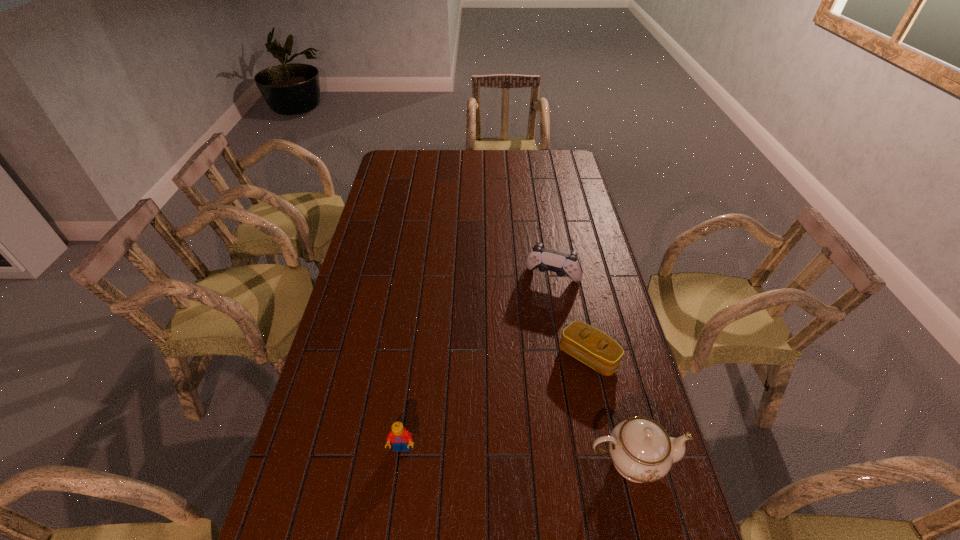
This screenshot has height=540, width=960. In order to click on Lego in this screenshot , I will do `click(400, 438)`.

Find the location of `the second shortest object`. the second shortest object is located at coordinates (400, 438).

The width and height of the screenshot is (960, 540). In order to click on chinaware in this screenshot , I will do `click(641, 450)`.

Where is `control`? control is located at coordinates (563, 264).

Locate an element on the screen. This screenshot has width=960, height=540. clutch bag is located at coordinates (584, 342).

I want to click on the shortest object, so click(x=584, y=342).

Identify the location of free region located on the face of the leftmost object. (396, 493).

Locate an element on the screen. The height and width of the screenshot is (540, 960). free spot located on the front-facing side of the control is located at coordinates (535, 315).

You are a GUI agent. You are given a task and a screenshot of the screen. Output one action in this format:
    pyautogui.click(x=<x>, y=<y>)
    Task: Click on the vacant area located 0.330m on the front-facing side of the control
    The height and width of the screenshot is (540, 960).
    Given the screenshot: What is the action you would take?
    pyautogui.click(x=516, y=362)

The height and width of the screenshot is (540, 960). What are the coordinates of `vacant space located 0.320m on the front-facing side of the control` in the screenshot? It's located at (517, 360).